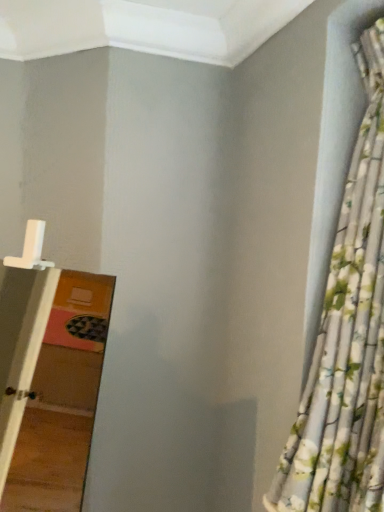
This screenshot has height=512, width=384. What do you see at coordinates (347, 339) in the screenshot?
I see `floral fabric curtain at right` at bounding box center [347, 339].

Locate an element on the screen. This screenshot has height=512, width=384. floral fabric curtain at right is located at coordinates (347, 339).

Image resolution: width=384 pixels, height=512 pixels. What are the coordinates of `white plastic ladder at left` in the screenshot? It's located at (48, 376).

What do you see at coordinates (48, 376) in the screenshot? This screenshot has width=384, height=512. I see `white plastic ladder at left` at bounding box center [48, 376].

Where is `floral fabric curtain at right`? Image resolution: width=384 pixels, height=512 pixels. floral fabric curtain at right is located at coordinates (347, 339).

Does white plastic ladder at left appear on the right side of floral fabric curtain at right?

In fact, white plastic ladder at left is to the left of floral fabric curtain at right.

Is white plastic ladder at left behind floral fabric curtain at right?

No, white plastic ladder at left is closer to the viewer.

Which point is more forward, [30,286] or [320,370]?

Positioned in front is point [320,370].

From the image's perspective, would you say white plastic ladder at left is shown under floral fabric curtain at right?

Yes, from the image's perspective, white plastic ladder at left is below floral fabric curtain at right.

From a real-world perspective, is white plastic ladder at left beneath floral fabric curtain at right?

Correct, in the physical world, white plastic ladder at left is lower than floral fabric curtain at right.

Considering the sizes of objects white plastic ladder at left and floral fabric curtain at right in the image provided, who is wider, white plastic ladder at left or floral fabric curtain at right?

Wider between the two is white plastic ladder at left.

Considering the sizes of objects white plastic ladder at left and floral fabric curtain at right in the image provided, who is taller, white plastic ladder at left or floral fabric curtain at right?

Standing taller between the two is floral fabric curtain at right.

Who is bigger, white plastic ladder at left or floral fabric curtain at right?

white plastic ladder at left.

Does white plastic ladder at left contain floral fabric curtain at right?

No.

Is the surface of white plastic ladder at left in direct contact with floral fabric curtain at right?

white plastic ladder at left is not next to floral fabric curtain at right, and they're not touching.

Consider the image. Could you tell me if white plastic ladder at left is turned towards floral fabric curtain at right?

No.

Can you tell me how much white plastic ladder at left and floral fabric curtain at right differ in facing direction?

The angular difference between white plastic ladder at left and floral fabric curtain at right is 49.1 degrees.

The image size is (384, 512). In order to click on curtain that appears above the white plastic ladder at left (from a real-world perspective) in this screenshot , I will do `click(347, 339)`.

Based on their positions, is floral fabric curtain at right located to the left or right of white plastic ladder at left?

Based on their positions, floral fabric curtain at right is located to the right of white plastic ladder at left.

Between floral fabric curtain at right and white plastic ladder at left, which one is positioned in front?

white plastic ladder at left is more forward.

Between point (369, 149) and point (61, 453), which one is positioned in front?

The point (369, 149) is in front.

From the image's perspective, which object appears higher, floral fabric curtain at right or white plastic ladder at left?

From the image's view, floral fabric curtain at right is above.

From a real-world perspective, is floral fabric curtain at right below white plastic ladder at left?

No, from a real-world perspective, floral fabric curtain at right is not below white plastic ladder at left.

Considering the sizes of floral fabric curtain at right and white plastic ladder at left in the image, is floral fabric curtain at right wider or thinner than white plastic ladder at left?

In the image, floral fabric curtain at right appears to be more narrow than white plastic ladder at left.

Considering the sizes of objects floral fabric curtain at right and white plastic ladder at left in the image provided, who is taller, floral fabric curtain at right or white plastic ladder at left?

With more height is floral fabric curtain at right.

Can you confirm if floral fabric curtain at right is bigger than white plastic ladder at left?

Incorrect, floral fabric curtain at right is not larger than white plastic ladder at left.

Is floral fabric curtain at right not within white plastic ladder at left?

Yes, floral fabric curtain at right is located beyond the bounds of white plastic ladder at left.

Is floral fabric curtain at right touching white plastic ladder at left?

No, floral fabric curtain at right is not beside white plastic ladder at left.

Is floral fabric curtain at right oriented towards white plastic ladder at left?

No, floral fabric curtain at right does not turn towards white plastic ladder at left.

Looking at this image, how many degrees apart are the facing directions of floral fabric curtain at right and white plastic ladder at left?

They differ by 49.1 degrees in their facing directions.

Where is `ladder in front of the floral fabric curtain at right`? The width and height of the screenshot is (384, 512). ladder in front of the floral fabric curtain at right is located at coordinates (48, 376).

The width and height of the screenshot is (384, 512). In order to click on curtain lying behind the white plastic ladder at left in this screenshot , I will do `click(347, 339)`.

Where is `ladder below the floral fabric curtain at right (from the image's perspective)`? ladder below the floral fabric curtain at right (from the image's perspective) is located at coordinates (48, 376).